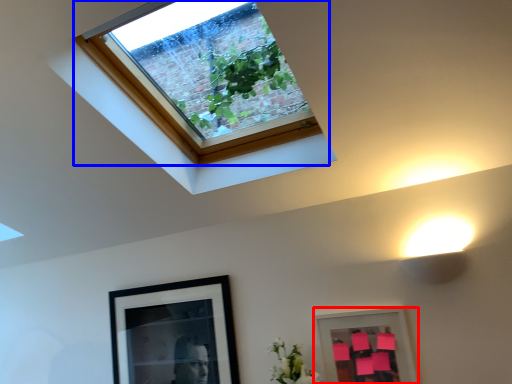
Question: Which object is closer to the camera taking this photo, picture frame (highlighted by a red box) or window (highlighted by a blue box)?

Choices:
 (A) picture frame
 (B) window

Answer: (B)